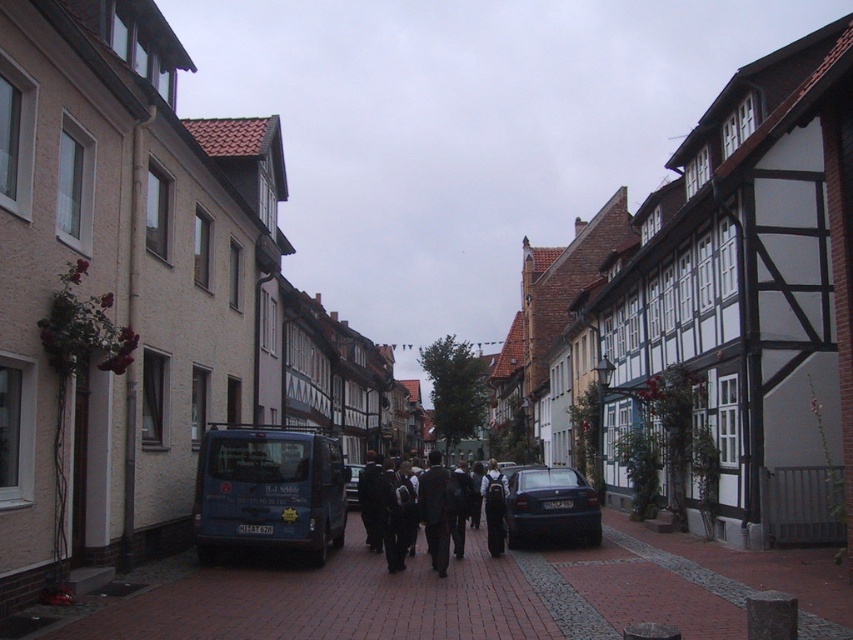
Question: Can you confirm if blue metallic bus at center is bigger than dark gray backpack at center?

Choices:
 (A) yes
 (B) no

Answer: (B)

Question: Which point is farther from the camera taking this photo?

Choices:
 (A) (589, 515)
 (B) (461, 556)
 (C) (244, 451)

Answer: (A)

Question: Among these points, which one is nearest to the camera?

Choices:
 (A) (200, 524)
 (B) (535, 493)

Answer: (A)

Question: Which point is farther from the camera taking this photo?

Choices:
 (A) (361, 588)
 (B) (496, 540)

Answer: (B)

Question: Is brick pavement at center to the right of dark gray backpack at center from the viewer's perspective?

Choices:
 (A) yes
 (B) no

Answer: (B)

Question: Is shiny dark blue sedan at center wider than dark gray backpack at center?

Choices:
 (A) no
 (B) yes

Answer: (B)